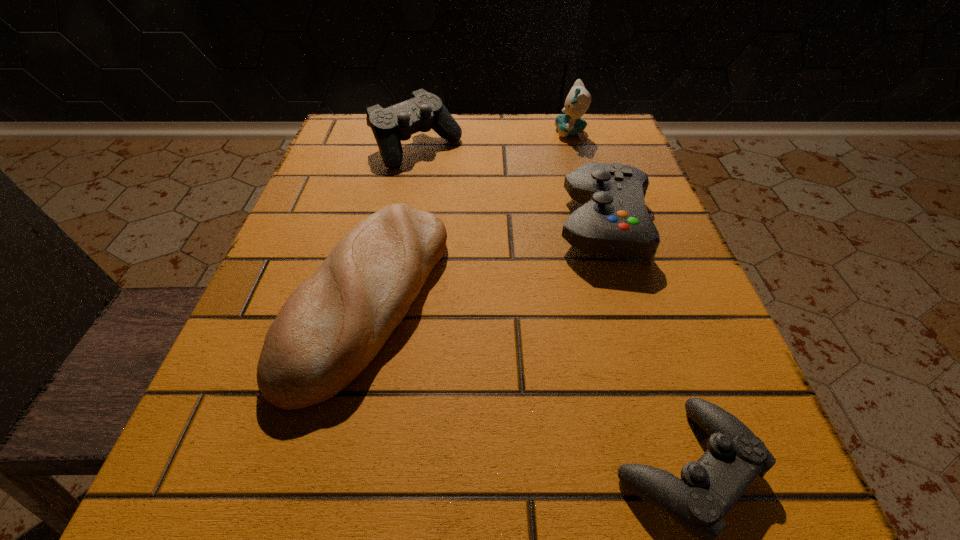
Locate an element on the screen. The image size is (960, 540). kitten at the far edge is located at coordinates (578, 100).

Locate an element on the screen. control that is at the far edge is located at coordinates (424, 111).

You are a GUI agent. You are given a task and a screenshot of the screen. Output one action in this format:
    pyautogui.click(x=<x>, y=<y>)
    Task: Click on the control that is at the left edge
    The width and height of the screenshot is (960, 540).
    Given the screenshot: What is the action you would take?
    pyautogui.click(x=424, y=111)

I want to click on bread situated at the left edge, so [x=330, y=328].

Where is `kitten at the right edge`? The image size is (960, 540). kitten at the right edge is located at coordinates (578, 100).

The width and height of the screenshot is (960, 540). I want to click on control at the right edge, so click(x=613, y=220).

Locate an element on the screen. This screenshot has height=540, width=960. object at the far left corner is located at coordinates (424, 111).

This screenshot has height=540, width=960. In order to click on object positioned at the far right corner in this screenshot , I will do `click(578, 100)`.

You are a GUI agent. You are given a task and a screenshot of the screen. Output one action in this format:
    pyautogui.click(x=<x>, y=<y>)
    Task: Click on the free region at the far edge of the desktop
    This screenshot has width=960, height=540.
    Given the screenshot: What is the action you would take?
    pyautogui.click(x=479, y=137)

Image resolution: width=960 pixels, height=540 pixels. Find the location of `vacant point at the near edge`. vacant point at the near edge is located at coordinates (339, 505).